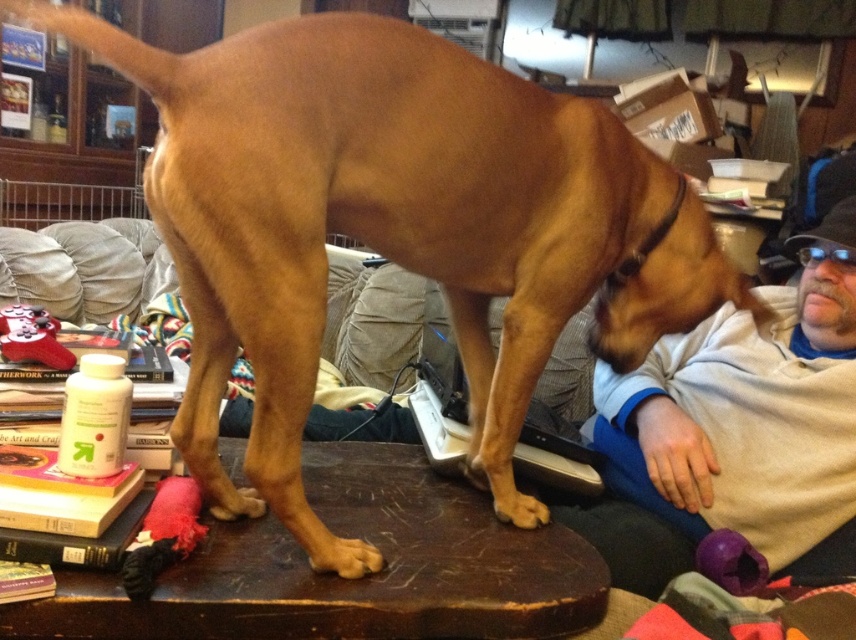
You are a photographer trying to capture a photo of the brown wooden table at center and the brown rough fur paw at lower center. To ensure both are in the frame, which object should you position closer to the camera?

The brown rough fur paw at lower center should be positioned closer to the camera because it is to the right of the brown wooden table at center, so moving it closer would help keep both in frame.

You are a delivery robot trying to place a package on the table. The table has a red plush stocking at upper left and a golden fur paw at lower center. Which object has a wider base so you can place the package next to it?

The red plush stocking at upper left has a wider base than the golden fur paw at lower center, so you can place the package next to it.

You are a photographer trying to capture the brown wooden table at center in the image. The table has coordinates given as point (x=348, y=579). If you want to focus on this point, where should you aim your camera?

The point (x=348, y=579) corresponds to the brown wooden table at center, so you should aim your camera at the brown wooden table at center to focus on that coordinate.